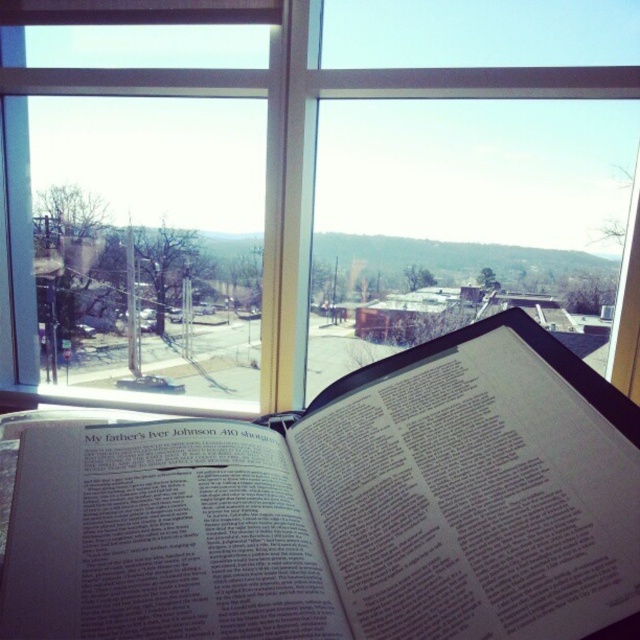
You are standing in the room looking through the window. There are two points marked on the glass. The first point is at coordinate point (291, 536) and the second point is at coordinate point (227, 4). Which point is closer to you?

Point (291, 536) is in front of point (227, 4), so it is closer to you.

You are a librarian organizing books on a shelf. The shelf has a coordinate system where the bottom left corner is at point 0,0 and the top right corner is at 1,1. You need to place the white paper book at center exactly at point 0.797, 0.541. Can you confirm if this coordinate is within the shelf boundaries?

The white paper book at center is positioned at point (346, 509), which is within the shelf boundaries since the coordinates are between 0 and 1.